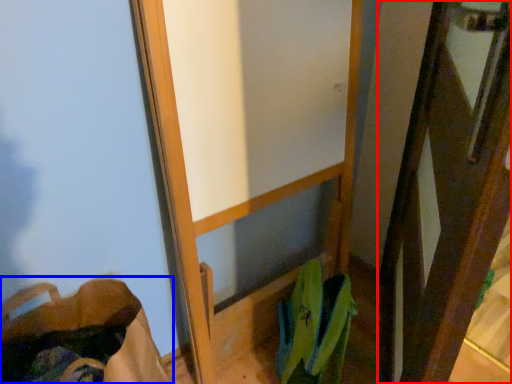
Question: Which object appears farthest to the camera in this image, screen door (highlighted by a red box) or shoulder bag (highlighted by a blue box)?

Choices:
 (A) screen door
 (B) shoulder bag

Answer: (B)